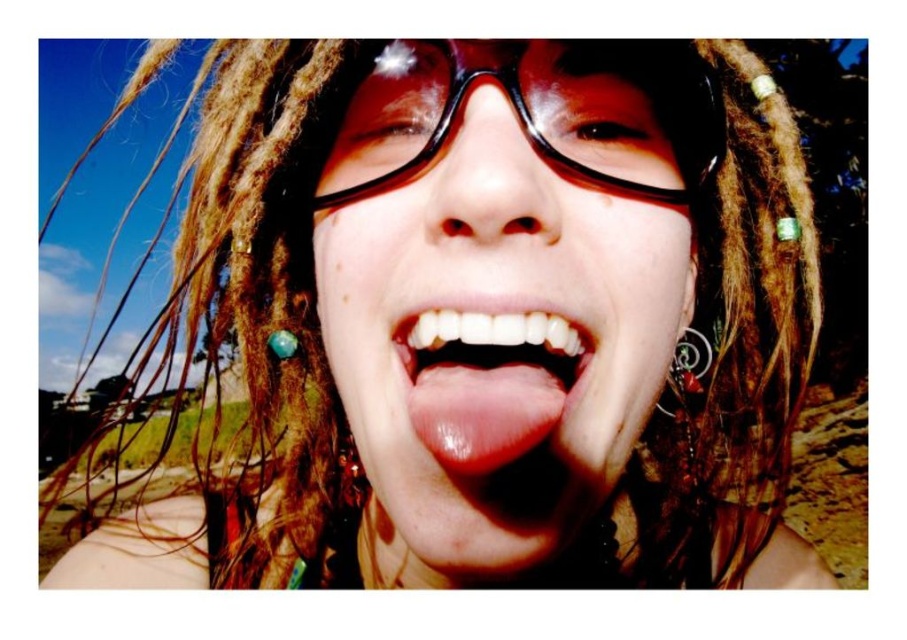
Question: Which point is closer to the camera?

Choices:
 (A) transparent plastic glasses at center
 (B) shiny white teeth at center

Answer: (B)

Question: Which object is positioned closest to the transparent plastic glasses at center?

Choices:
 (A) satin black glasses at center
 (B) shiny white teeth at center

Answer: (A)

Question: Is shiny white teeth at center closer to camera compared to transparent plastic glasses at center?

Choices:
 (A) yes
 (B) no

Answer: (A)

Question: Based on their relative distances, which object is nearer to the satin black glasses at center?

Choices:
 (A) transparent plastic glasses at center
 (B) shiny white teeth at center

Answer: (B)

Question: Does shiny white teeth at center come behind transparent plastic glasses at center?

Choices:
 (A) yes
 (B) no

Answer: (B)

Question: Is shiny white teeth at center bigger than transparent plastic glasses at center?

Choices:
 (A) yes
 (B) no

Answer: (B)